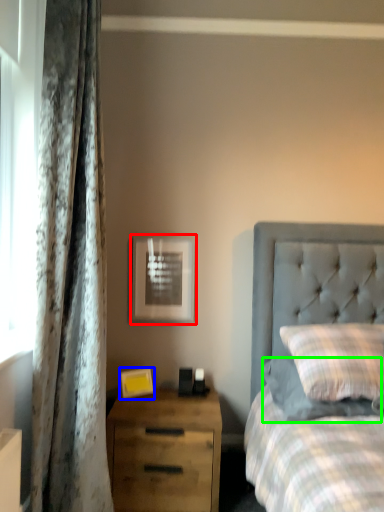
Question: Which object is the farthest from picture frame (highlighted by a red box)? Choose among these: picture frame (highlighted by a blue box) or pillow (highlighted by a green box).

Choices:
 (A) picture frame
 (B) pillow

Answer: (B)